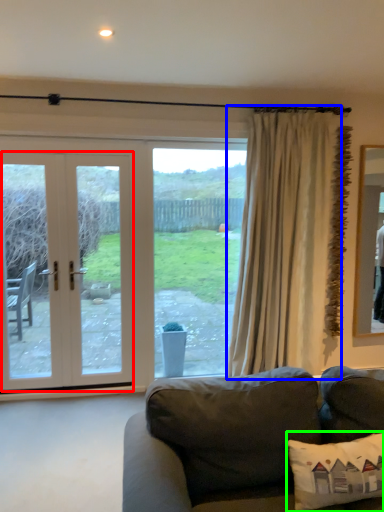
Question: Based on their relative distances, which object is farther from door (highlighted by a red box)? Choose from curtain (highlighted by a blue box) and pillow (highlighted by a green box).

Choices:
 (A) curtain
 (B) pillow

Answer: (B)